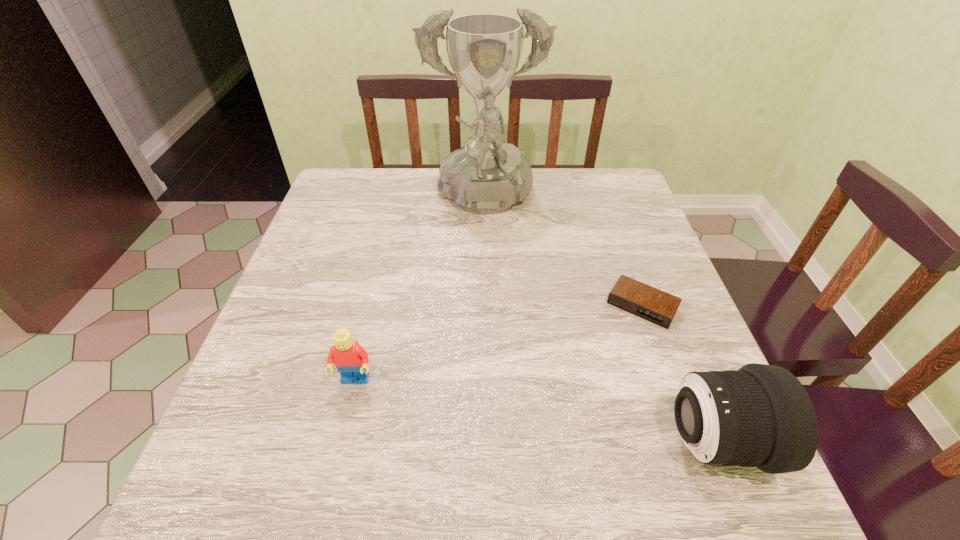
I want to click on vacant space that satisfies the following two spatial constraints: 1. on the front side of the award; 2. on the left side of the shortest object, so pyautogui.click(x=485, y=306).

You are a GUI agent. You are given a task and a screenshot of the screen. Output one action in this format:
    pyautogui.click(x=<x>, y=<y>)
    Task: Click on the free space that satisfies the following two spatial constraints: 1. on the front side of the alarm clock; 2. at the front element of the third shortest object
    The width and height of the screenshot is (960, 540).
    Given the screenshot: What is the action you would take?
    pyautogui.click(x=689, y=441)

Identify the location of vacant region that satisfies the following two spatial constraints: 1. on the face of the third farthest object; 2. at the front element of the telephoto lens. The height and width of the screenshot is (540, 960). (341, 441).

Locate an element on the screen. Image resolution: width=960 pixels, height=540 pixels. free space that satisfies the following two spatial constraints: 1. on the face of the telephoto lens; 2. at the front element of the Lego is located at coordinates (341, 441).

Find the location of a particular element. The image size is (960, 540). vacant area that satisfies the following two spatial constraints: 1. on the face of the nearest object; 2. at the front element of the leftmost object is located at coordinates (341, 441).